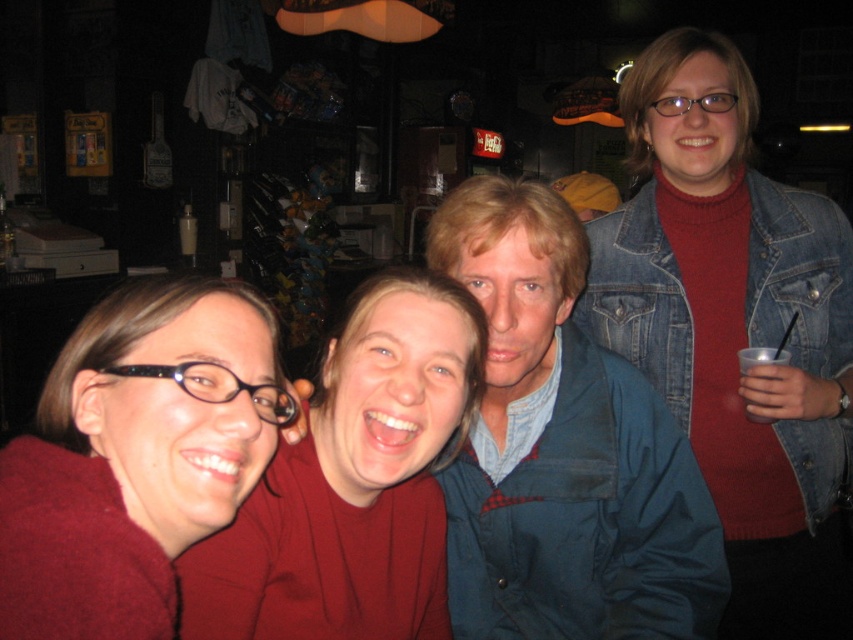
Can you confirm if denim jacket at upper right is taller than blue denim jacket at center?

Correct, denim jacket at upper right is much taller as blue denim jacket at center.

Consider the image. Which is above, denim jacket at upper right or blue denim jacket at center?

blue denim jacket at center

Is point (755, 440) positioned after point (566, 528)?

Yes.

Find the location of a particular element. denim jacket at upper right is located at coordinates [735, 330].

Can you confirm if blue denim jacket at center is positioned to the left of matte red sweater at lower left?

In fact, blue denim jacket at center is to the right of matte red sweater at lower left.

Is blue denim jacket at center below matte red sweater at lower left?

Correct, blue denim jacket at center is located below matte red sweater at lower left.

Is point (488, 410) more distant than point (137, 435)?

That is True.

Identify the location of blue denim jacket at center. (563, 451).

Can you confirm if denim jacket at upper right is positioned to the right of matte red shirt at center?

Yes, denim jacket at upper right is to the right of matte red shirt at center.

Measure the distance between point [790,509] and camera.

1.63 meters

Is point (662, 77) positioned before point (235, 524)?

No, (662, 77) is behind (235, 524).

Image resolution: width=853 pixels, height=640 pixels. In order to click on denim jacket at upper right in this screenshot , I will do `click(735, 330)`.